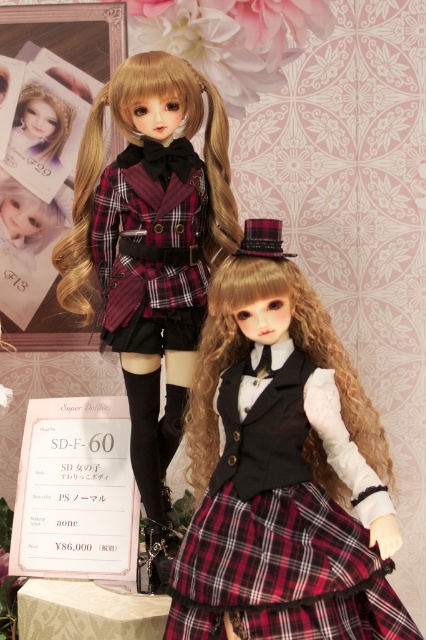
Looking at this image, between matte black doll at upper left and plaid fabric skirt at center, which one has less height?

With less height is plaid fabric skirt at center.

Locate an element on the screen. The height and width of the screenshot is (640, 426). matte black doll at upper left is located at coordinates (150, 253).

Who is more forward, (253, 348) or (144, 328)?

Point (253, 348)

Which is behind, point (236, 612) or point (124, 344)?

Positioned behind is point (124, 344).

Between point (222, 362) and point (127, 324), which one is positioned in front?

Point (222, 362)

I want to click on plaid fabric dress at center, so click(x=281, y=468).

Locate an element on the screen. plaid fabric dress at center is located at coordinates (281, 468).

Is point (299, 516) closer to camera compared to point (239, 612)?

No.

Between point (227, 531) and point (383, 576), which one is positioned in front?

Point (227, 531) is in front.

You are a GUI agent. You are given a task and a screenshot of the screen. Output one action in this format:
    pyautogui.click(x=<x>, y=<y>)
    Task: Click on the plaid fabric dress at center
    
    Given the screenshot: What is the action you would take?
    pyautogui.click(x=281, y=468)